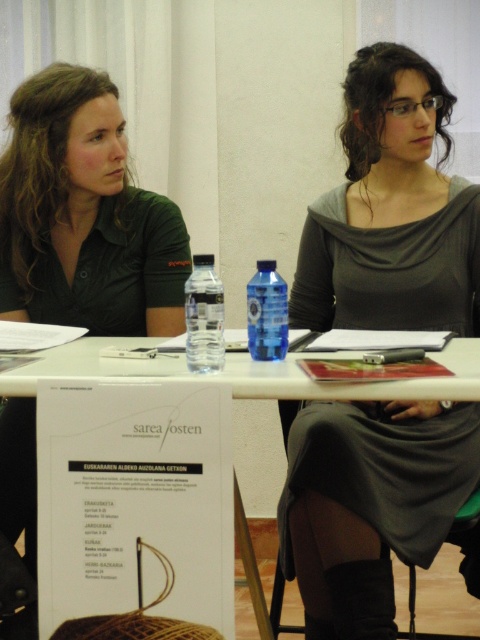
Question: Based on their relative distances, which object is farther from the gray matte dress at center?

Choices:
 (A) matte green polo shirt at left
 (B) transparent plastic bottle at center
 (C) white paper at center
 (D) blue plastic bottle at center

Answer: (B)

Question: Which point is closer to the camera taking this photo?

Choices:
 (A) (386, 196)
 (B) (35, 212)
 (C) (110, 348)
 (D) (187, 296)

Answer: (D)

Question: Is gray matte dress at center smaller than blue plastic bottle at center?

Choices:
 (A) no
 (B) yes

Answer: (A)

Question: Does gray matte dress at center have a lesser width compared to matte green polo shirt at left?

Choices:
 (A) yes
 (B) no

Answer: (B)

Question: Observing the image, what is the correct spatial positioning of white paper at center in reference to blue plastic bottle at center?

Choices:
 (A) above
 (B) below

Answer: (B)

Question: Which object is farther from the camera taking this photo?

Choices:
 (A) gray matte dress at center
 (B) transparent plastic bottle at center
 (C) blue plastic bottle at center
 (D) matte green polo shirt at left

Answer: (D)